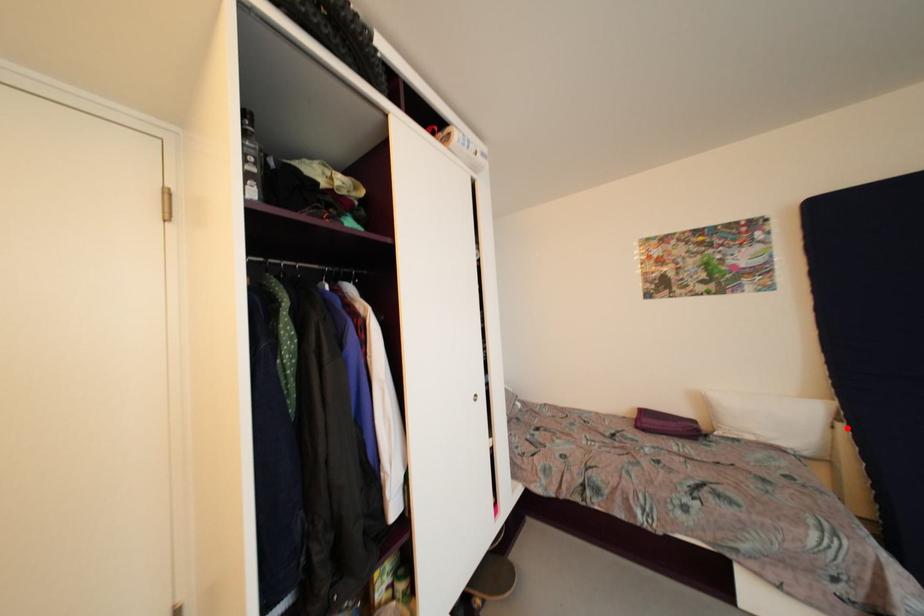
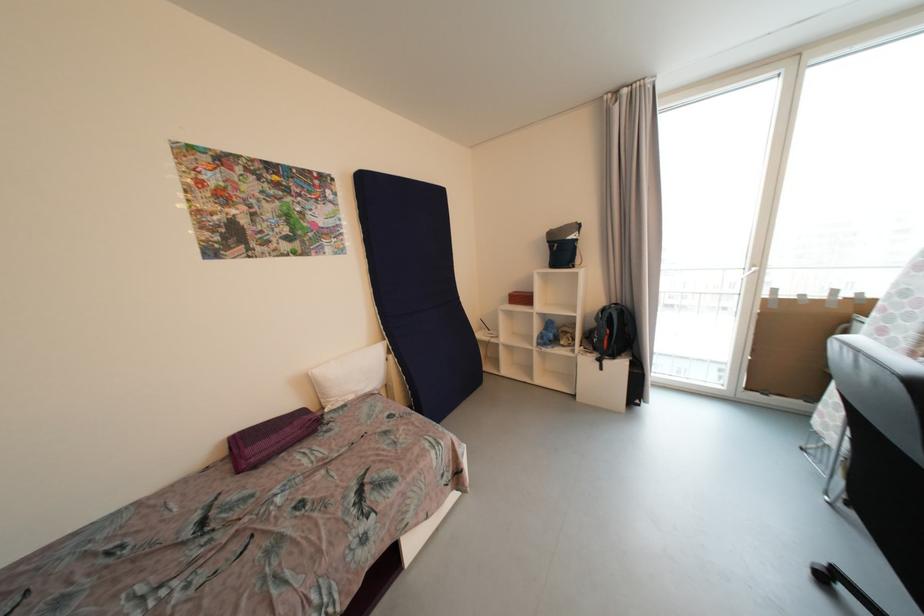
In the second image, find the point that corresponds to the highlighted location in the first image.

(396, 359)